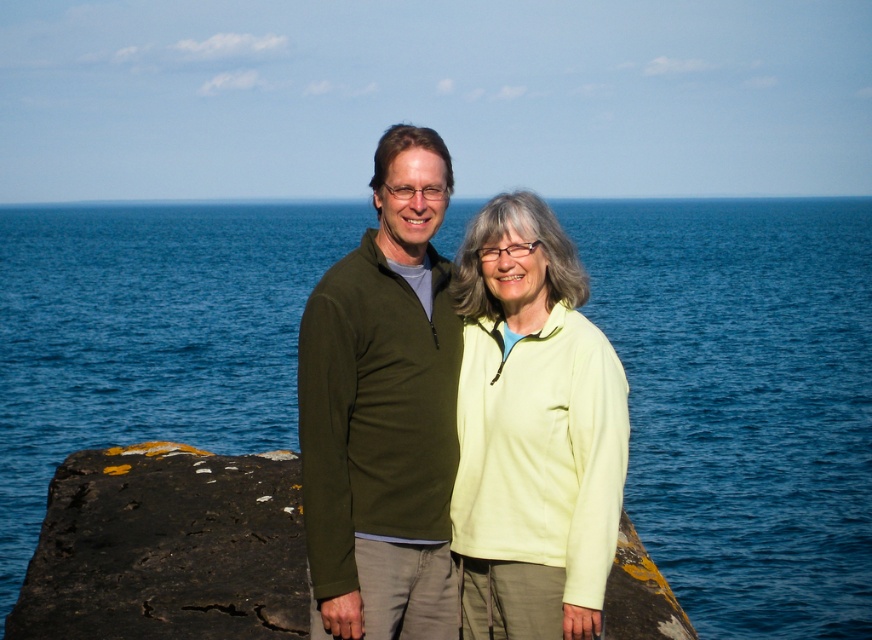
You are a drone operator trying to capture a photo of the two people standing on the rocky outcrop. The camera is positioned to focus on the blue liquid water at center. According to the coordinates provided, where should you adjust the camera to ensure the two people are in the frame?

The blue liquid water at center is located at coordinates (744, 401). Since the two people are on the rocky outcrop overlooking the water, adjusting the camera to focus on this point would position the water at the center of the image, which would likely keep the people in the frame near the lower portion of the photo.

You are a hiker who wants to cross from the black rough rock at center to the blue liquid water at center. Is the path directly between them safe to walk on?

The blue liquid water at center is positioned over black rough rock at center, so the path between them is covered by water. Walking on it may be unsafe due to the water covering the rocks.

You are a photographer planning to take a landscape shot of the blue liquid water at center and the olive green sweater at center. Which object should you focus on first to ensure it appears sharp in the photo?

The blue liquid water at center is further to the viewer than the olive green sweater at center, so you should focus on the blue liquid water at center first to ensure it is sharp before adjusting for the olive green sweater at center.